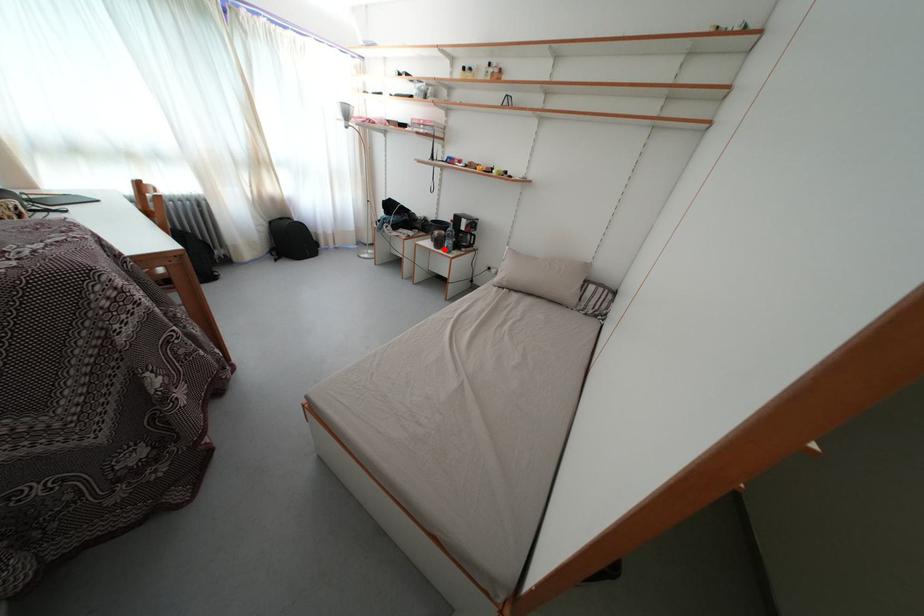
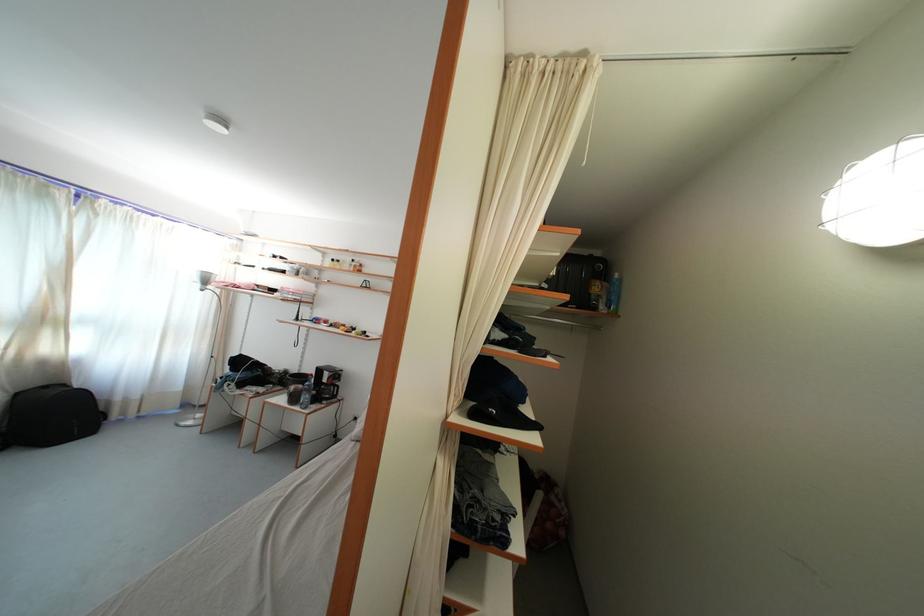
Question: I am providing you with two images of the same scene from different viewpoints. In image1, a red point is highlighted. Considering the same 3D point in image2, which of the following is correct?

Choices:
 (A) It is closer
 (B) It is farther

Answer: (B)